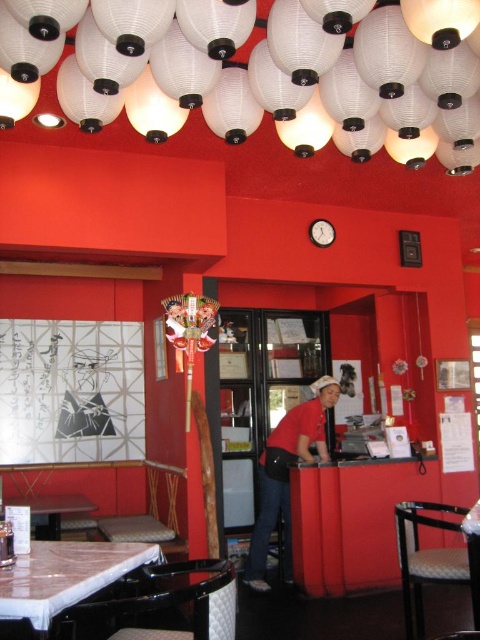
Question: Is marble top table at lower left positioned in front of marble top table at center?

Choices:
 (A) yes
 (B) no

Answer: (B)

Question: Which point is farther from the camera taking this photo?

Choices:
 (A) (50, 518)
 (B) (286, 451)
 (C) (468, 540)
 (D) (55, 584)

Answer: (B)

Question: Observing the image, what is the correct spatial positioning of white paper lantern at upper center in reference to marble top table at center?

Choices:
 (A) left
 (B) right

Answer: (A)

Question: Considering the real-world distances, which object is closest to the marble top table at center?

Choices:
 (A) white paper lantern at upper center
 (B) marble top table at lower left
 (C) white marble table at lower left
 (D) red matte shirt at center

Answer: (D)

Question: Which is farther from the marble top table at lower left?

Choices:
 (A) red matte shirt at center
 (B) marble top table at center
 (C) white paper lantern at upper center
 (D) white marble table at lower left

Answer: (C)

Question: Does white marble table at lower left have a smaller size compared to marble top table at lower left?

Choices:
 (A) no
 (B) yes

Answer: (B)